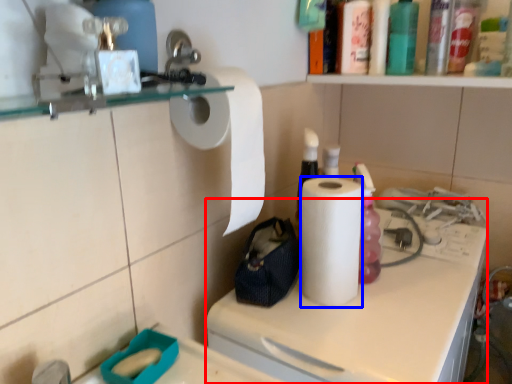
Question: Which object is further to the camera taking this photo, counter (highlighted by a red box) or paper towel (highlighted by a blue box)?

Choices:
 (A) counter
 (B) paper towel

Answer: (B)